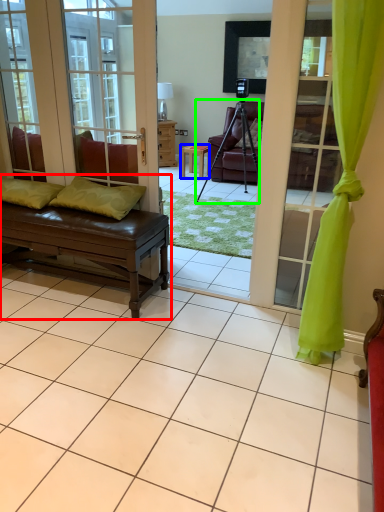
Question: Which object is the farthest from studio couch (highlighted by a red box)? Choose among these: table (highlighted by a blue box) or tripod (highlighted by a green box).

Choices:
 (A) table
 (B) tripod

Answer: (A)